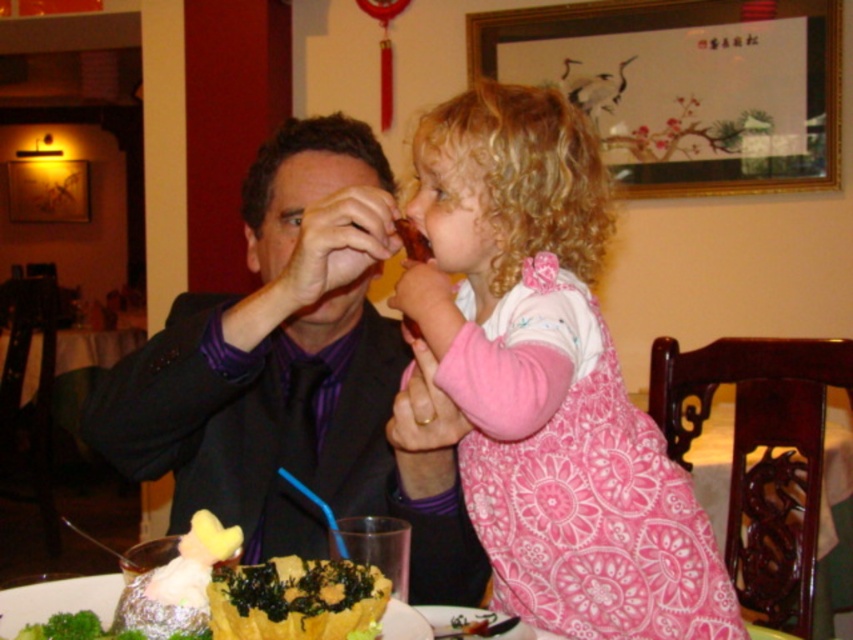
You are a restaurant server who needs to place a new bowl on the table without touching the existing items. The table has the matte black suit at center and the yellow matte bowl at lower center. Which object should you avoid placing the new bowl near because it takes up more space?

The matte black suit at center takes up more space than the yellow matte bowl at lower center, so you should avoid placing the new bowl near the matte black suit at center.

Consider the image. What are the coordinates of the pink floral dress at upper right?

The pink floral dress at upper right is located at point (550, 380).